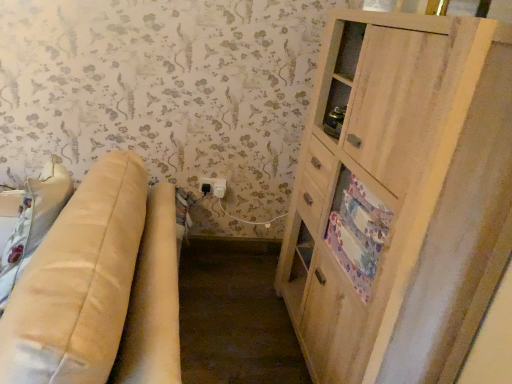
What do you see at coordinates (213, 187) in the screenshot? I see `black plastic electric outlet at lower center` at bounding box center [213, 187].

The image size is (512, 384). What do you see at coordinates (100, 287) in the screenshot? I see `beige leather couch at left` at bounding box center [100, 287].

This screenshot has width=512, height=384. Identify the location of beige leather couch at left. (100, 287).

At what (x,y) coordinates should I click in order to perform the action: click on light wood cabinet at right. Please return your answer as a coordinate pair (x, y). The image size is (512, 384). Looking at the image, I should click on (400, 197).

Image resolution: width=512 pixels, height=384 pixels. What do you see at coordinates (400, 197) in the screenshot? I see `light wood cabinet at right` at bounding box center [400, 197].

The width and height of the screenshot is (512, 384). Find the location of `black plastic electric outlet at lower center`. black plastic electric outlet at lower center is located at coordinates (213, 187).

Considering their positions, is light wood cabinet at right located in front of or behind black plastic electric outlet at lower center?

In the image, light wood cabinet at right appears in front of black plastic electric outlet at lower center.

Considering the relative positions of light wood cabinet at right and black plastic electric outlet at lower center in the image provided, is light wood cabinet at right to the left of black plastic electric outlet at lower center from the viewer's perspective?

In fact, light wood cabinet at right is to the right of black plastic electric outlet at lower center.

Looking at this image, is light wood cabinet at right wider than black plastic electric outlet at lower center?

Yes.

Are light wood cabinet at right and black plastic electric outlet at lower center beside each other?

No, light wood cabinet at right is not next to black plastic electric outlet at lower center.

Considering the positions of points (359, 282) and (393, 164), is point (359, 282) closer to camera compared to point (393, 164)?

No, (359, 282) is behind (393, 164).

Based on the photo, is floral fabric drawer at right in contact with light wood cabinet at right?

No, floral fabric drawer at right is not in contact with light wood cabinet at right.

Is floral fabric drawer at right closer to camera compared to light wood cabinet at right?

That is False.

Considering the relative sizes of black plastic electric outlet at lower center and beige leather couch at left in the image provided, is black plastic electric outlet at lower center smaller than beige leather couch at left?

Indeed, black plastic electric outlet at lower center has a smaller size compared to beige leather couch at left.

From a real-world perspective, is black plastic electric outlet at lower center below beige leather couch at left?

No, from a real-world perspective, black plastic electric outlet at lower center is not under beige leather couch at left.

Visually, is black plastic electric outlet at lower center positioned to the left or to the right of beige leather couch at left?

A: Based on their positions, black plastic electric outlet at lower center is located to the right of beige leather couch at left.

Are floral fabric drawer at right and black plastic electric outlet at lower center making contact?

No, floral fabric drawer at right is not next to black plastic electric outlet at lower center.

From a real-world perspective, is floral fabric drawer at right over black plastic electric outlet at lower center?

Yes, from a real-world perspective, floral fabric drawer at right is above black plastic electric outlet at lower center.

From the picture: Can you tell me how much floral fabric drawer at right and black plastic electric outlet at lower center differ in facing direction?

The angular difference between floral fabric drawer at right and black plastic electric outlet at lower center is 89.6 degrees.

From a real-world perspective, who is located higher, beige leather couch at left or floral fabric drawer at right?

floral fabric drawer at right is physically above.

I want to click on drawer lying behind the beige leather couch at left, so click(358, 232).

Choose the correct answer: Is beige leather couch at left inside floral fabric drawer at right or outside it?

beige leather couch at left is spatially situated outside floral fabric drawer at right.

Considering the positions of objects beige leather couch at left and floral fabric drawer at right in the image provided, who is more to the left, beige leather couch at left or floral fabric drawer at right?

beige leather couch at left.

Who is taller, black plastic electric outlet at lower center or light wood cabinet at right?

light wood cabinet at right.

Would you say black plastic electric outlet at lower center is a long distance from light wood cabinet at right?

black plastic electric outlet at lower center is far away from light wood cabinet at right.

From the image's perspective, which is above, black plastic electric outlet at lower center or light wood cabinet at right?

black plastic electric outlet at lower center is shown above in the image.

From the picture: Is beige leather couch at left taller or shorter than black plastic electric outlet at lower center?

Considering their sizes, beige leather couch at left has more height than black plastic electric outlet at lower center.

Consider the image. Is beige leather couch at left in front of or behind black plastic electric outlet at lower center in the image?

In the image, beige leather couch at left appears in front of black plastic electric outlet at lower center.

Is beige leather couch at left turned away from black plastic electric outlet at lower center?

No, beige leather couch at left is not facing the opposite direction of black plastic electric outlet at lower center.

Is beige leather couch at left next to black plastic electric outlet at lower center and touching it?

No, beige leather couch at left is not next to black plastic electric outlet at lower center.

Where is `electric outlet on the left of light wood cabinet at right`? This screenshot has width=512, height=384. electric outlet on the left of light wood cabinet at right is located at coordinates point(213,187).

In order to click on cabinetry to the right of floral fabric drawer at right in this screenshot , I will do `click(400, 197)`.

When comparing their distances from black plastic electric outlet at lower center, does floral fabric drawer at right or beige leather couch at left seem closer?

floral fabric drawer at right.

Which object lies nearer to the anchor point black plastic electric outlet at lower center, beige leather couch at left or floral fabric drawer at right?

floral fabric drawer at right is positioned closer to the anchor black plastic electric outlet at lower center.

From the image, which object appears to be farther from beige leather couch at left, light wood cabinet at right or black plastic electric outlet at lower center?

black plastic electric outlet at lower center.

Based on their spatial positions, is light wood cabinet at right or floral fabric drawer at right further from beige leather couch at left?

Among the two, light wood cabinet at right is located further to beige leather couch at left.

Which object lies further to the anchor point floral fabric drawer at right, light wood cabinet at right or black plastic electric outlet at lower center?

black plastic electric outlet at lower center is positioned further to the anchor floral fabric drawer at right.

Which object lies nearer to the anchor point floral fabric drawer at right, beige leather couch at left or black plastic electric outlet at lower center?

beige leather couch at left.

Which object lies nearer to the anchor point light wood cabinet at right, black plastic electric outlet at lower center or beige leather couch at left?

beige leather couch at left.

From the image, which object appears to be farther from light wood cabinet at right, floral fabric drawer at right or black plastic electric outlet at lower center?

black plastic electric outlet at lower center is further to light wood cabinet at right.

You are a GUI agent. You are given a task and a screenshot of the screen. Output one action in this format:
    pyautogui.click(x=<x>, y=<y>)
    Task: Click on the drawer located between light wood cabinet at right and black plastic electric outlet at lower center in the depth direction
    
    Given the screenshot: What is the action you would take?
    tap(358, 232)

Locate an element on the screen. This screenshot has width=512, height=384. cabinetry between beige leather couch at left and black plastic electric outlet at lower center along the z-axis is located at coordinates (400, 197).

Image resolution: width=512 pixels, height=384 pixels. What are the coordinates of `drawer located between beige leather couch at left and black plastic electric outlet at lower center in the depth direction` in the screenshot? It's located at (358, 232).

Locate an element on the screen. This screenshot has height=384, width=512. drawer located between beige leather couch at left and light wood cabinet at right in the left-right direction is located at coordinates (358, 232).